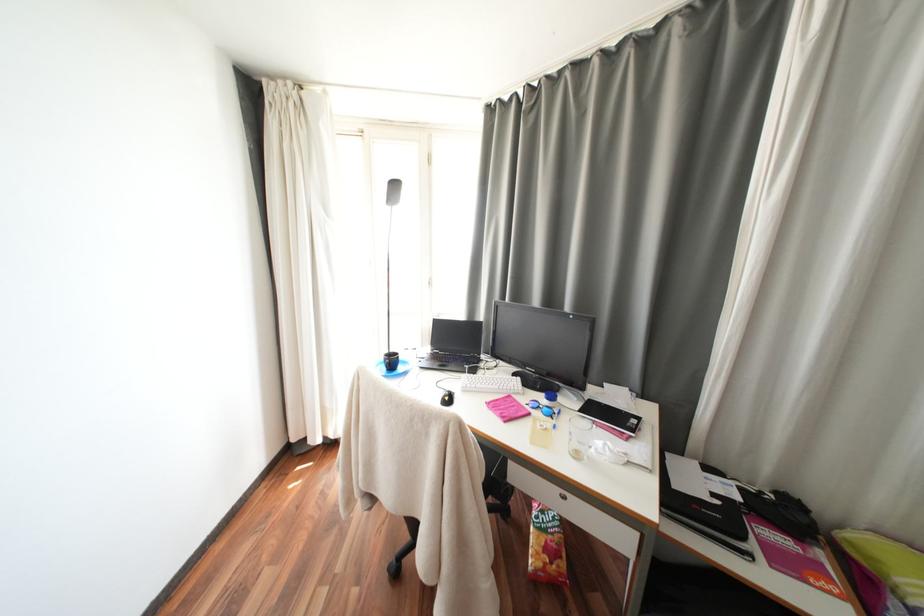
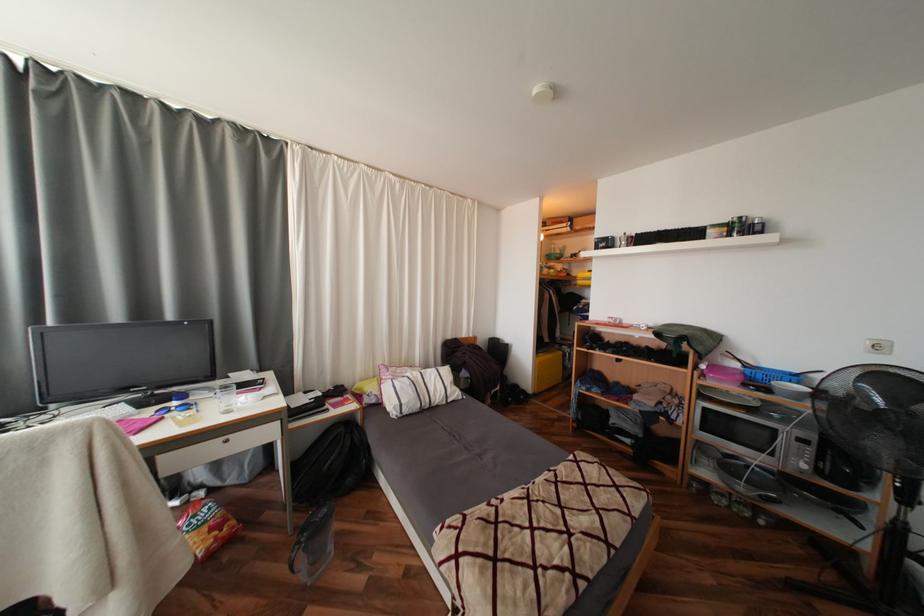
Question: The first image is from the beginning of the video and the second image is from the end. How did the camera likely rotate when shooting the video?

Choices:
 (A) Left
 (B) Right
 (C) Up
 (D) Down

Answer: (B)